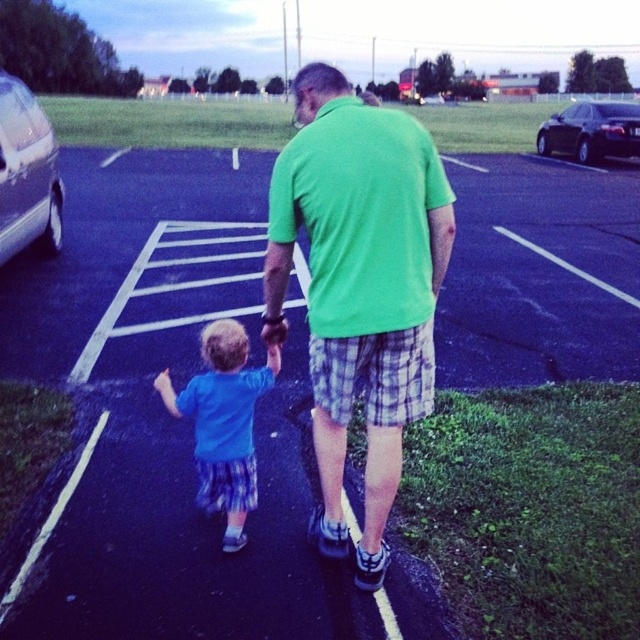
You are a delivery person trying to park your van between the silver metallic car at left and the shiny black sedan at upper right. The van is 6 meters long. Can you fit it there?

The silver metallic car at left is shorter than the shiny black sedan at upper right, but the distance between them isn not provided. Without knowing the space between the two cars, it is impossible to determine if the van will fit.